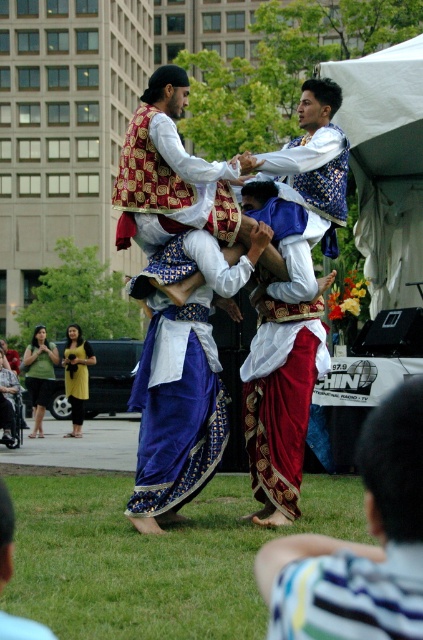
In the scene shown: You are a photographer at the event and want to capture a clear shot of the striped fabric pants at lower right without the green grass at lower center blocking it. What adjustment should you make to your camera position?

Move your camera position forward or closer to the striped fabric pants at lower right so that it comes into focus in front of the green grass at lower center, ensuring the pants are not obstructed by the grass.

You are standing at the origin point of the coordinate system. You see two points, point (170,100) and point (304,170). Which point is closer to you?

Point (170,100) is closer to you because it is in front of point (304,170).

You are a photographer standing at the edge of the grassy area where the cultural performance is happening. You want to take a photo that includes both the green grass at lower center and the striped fabric pants at lower right. Based on their positions, which object should you focus on first to ensure both are in frame?

The green grass at lower center is located below striped fabric pants at lower right, so you should focus on the striped fabric pants at lower right first to ensure both are in frame.